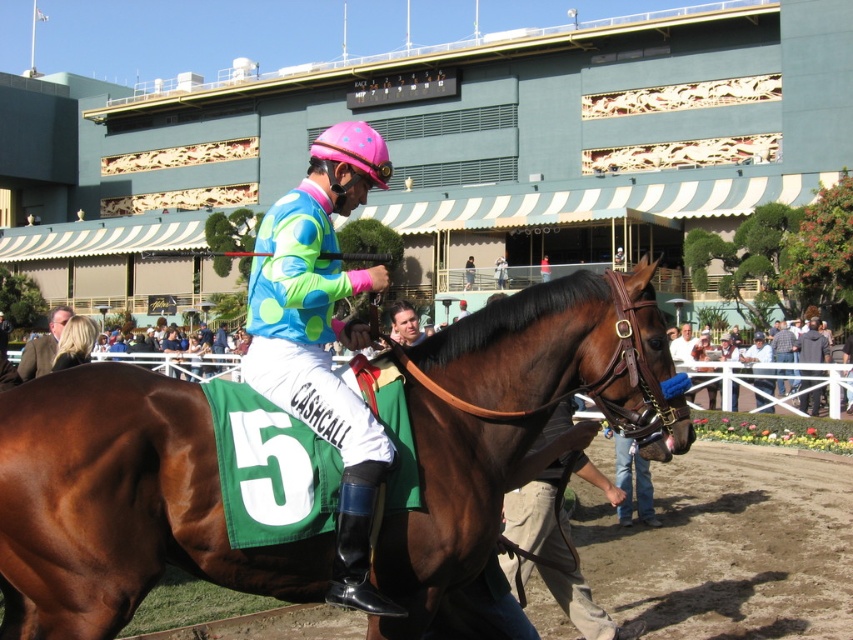
You are a photographer trying to capture the entire scene of the horse racing event. You notice the brown dirt track at center and the brown leather jacket at lower left. Which object should you focus on to ensure both are in frame without zooming in or out?

The brown dirt track at center is smaller than the brown leather jacket at lower left, so you should focus on the brown leather jacket at lower left to ensure both are in frame without zooming in or out.

You are a photographer at the horse racing event. You want to capture a photo of the brown glossy horse at center and the gray fabric jacket at right. Based on their positions, which object is closer to the camera?

The brown glossy horse at center is closer to the camera because it is positioned over the gray fabric jacket at right.

You are a photographer at the horse racing event. You want to take a photo that includes both the brown glossy horse at center and the gray fabric jacket at right. Based on their positions, which object should be placed on the left side of the photo frame?

The brown glossy horse at center should be placed on the left side of the photo frame because it is positioned on the left side of the gray fabric jacket at right.